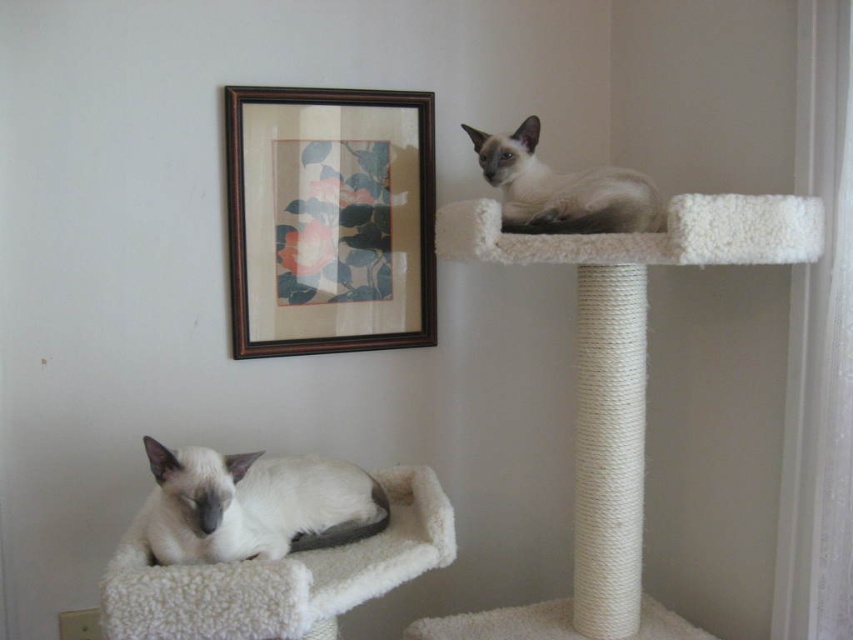
Does brown wooden picture frame at upper center appear on the right side of satin fur cat at upper right?

Incorrect, brown wooden picture frame at upper center is not on the right side of satin fur cat at upper right.

Can you confirm if brown wooden picture frame at upper center is positioned above satin fur cat at upper right?

Actually, brown wooden picture frame at upper center is below satin fur cat at upper right.

The image size is (853, 640). In order to click on brown wooden picture frame at upper center in this screenshot , I will do `click(329, 220)`.

Where is `brown wooden picture frame at upper center`? The width and height of the screenshot is (853, 640). brown wooden picture frame at upper center is located at coordinates (329, 220).

Can you confirm if brown wooden picture frame at upper center is positioned to the left of white fluffy cat bed at lower left?

In fact, brown wooden picture frame at upper center is to the right of white fluffy cat bed at lower left.

Is point (428, 234) more distant than point (289, 579)?

Yes, it is.

Where is `brown wooden picture frame at upper center`? brown wooden picture frame at upper center is located at coordinates tap(329, 220).

Which is above, white fluffy cat bed at lower left or satin fur cat at upper right?

Positioned higher is satin fur cat at upper right.

Does white fluffy cat bed at lower left appear over satin fur cat at upper right?

No, white fluffy cat bed at lower left is not above satin fur cat at upper right.

Identify the location of white fluffy cat bed at lower left. The height and width of the screenshot is (640, 853). (279, 576).

Identify the location of white fluffy cat bed at lower left. (279, 576).